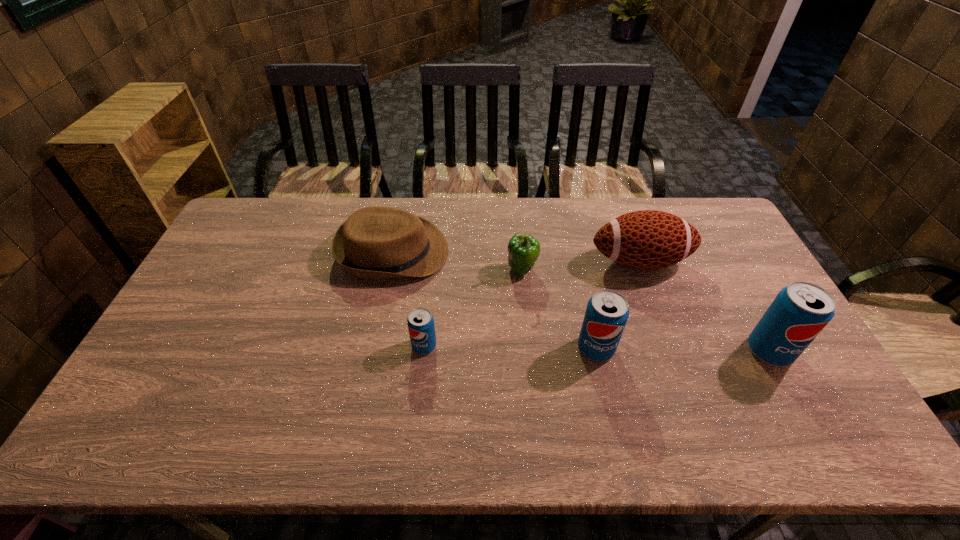
Identify the location of soda can that is the second nearest to the bell pepper. (420, 321).

The width and height of the screenshot is (960, 540). I want to click on free space that satisfies the following two spatial constraints: 1. on the front-facing side of the fedora; 2. on the back side of the third object from left to right, so click(390, 269).

In order to click on free region that satisfies the following two spatial constraints: 1. on the front-facing side of the rightmost soda can; 2. on the right side of the fedora in this screenshot , I will do `click(373, 351)`.

Identify the location of vacant area in the image that satisfies the following two spatial constraints: 1. on the front-facing side of the fedora; 2. on the right side of the leftmost soda can. The image size is (960, 540). (374, 346).

The image size is (960, 540). I want to click on free space that satisfies the following two spatial constraints: 1. on the front-facing side of the fedora; 2. on the back side of the football, so click(392, 261).

Where is `free region that satisfies the following two spatial constraints: 1. on the front side of the bell pepper; 2. on the right side of the rightmost object`? free region that satisfies the following two spatial constraints: 1. on the front side of the bell pepper; 2. on the right side of the rightmost object is located at coordinates (530, 351).

Where is `free region that satisfies the following two spatial constraints: 1. on the back side of the leftmost soda can; 2. on the front-facing side of the fedora`? free region that satisfies the following two spatial constraints: 1. on the back side of the leftmost soda can; 2. on the front-facing side of the fedora is located at coordinates pos(434,252).

Where is `free spot that satisfies the following two spatial constraints: 1. on the front-facing side of the fedora; 2. on the back side of the shortest soda can`? The image size is (960, 540). free spot that satisfies the following two spatial constraints: 1. on the front-facing side of the fedora; 2. on the back side of the shortest soda can is located at coordinates (374, 346).

Locate an element on the screen. This screenshot has height=540, width=960. vacant space that satisfies the following two spatial constraints: 1. on the front-facing side of the fedora; 2. on the back side of the second soda can from right to left is located at coordinates (374, 348).